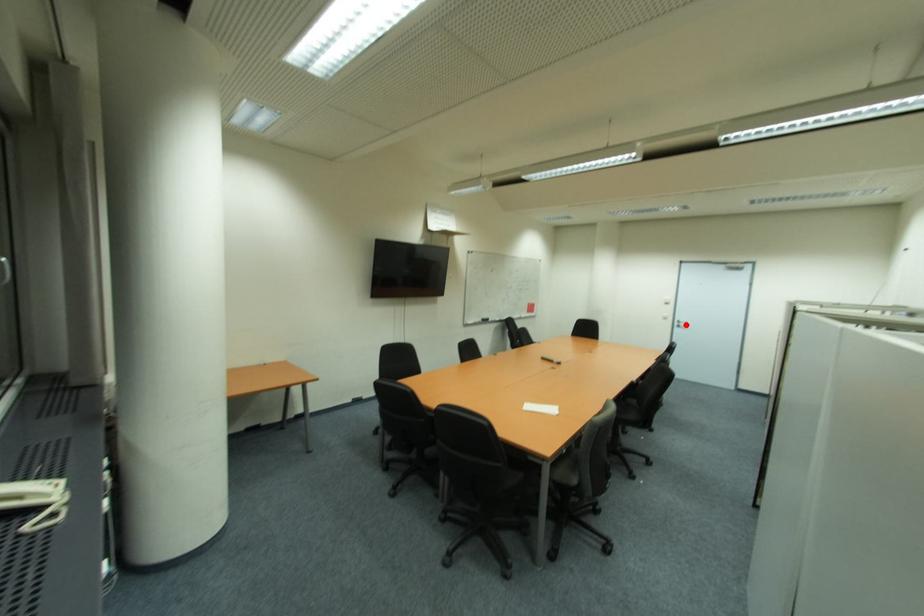
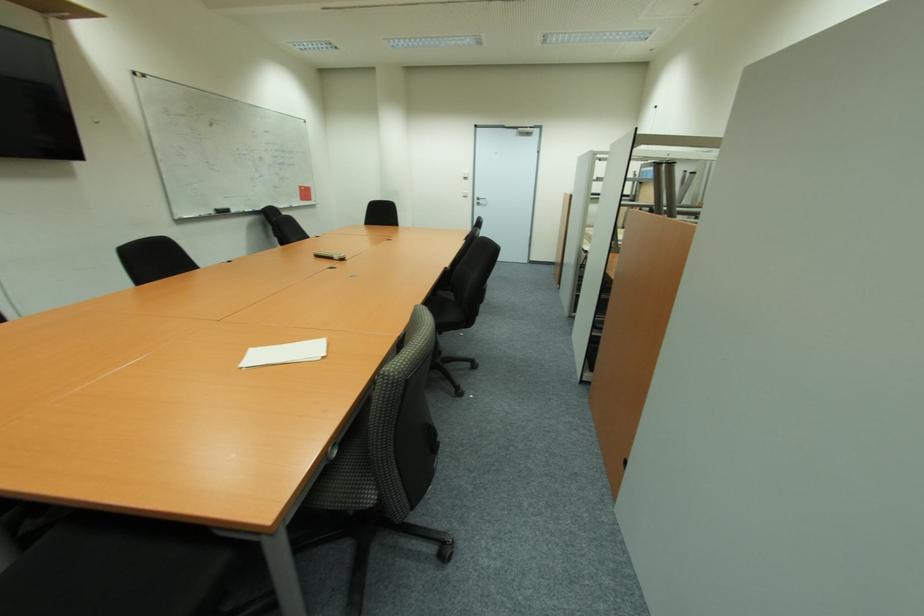
Locate, in the second image, the point that corresponds to the highlighted location in the first image.

(483, 203)